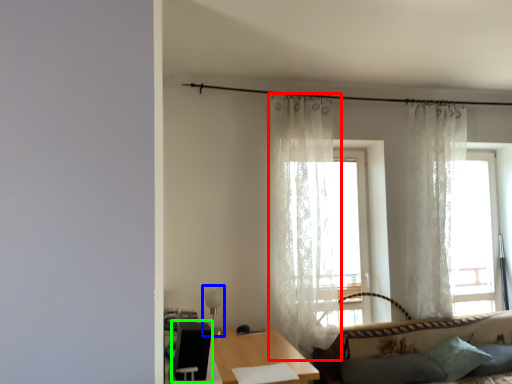
Question: Based on their relative distances, which object is nearer to curtain (highlighted by a red box)? Choose from lamp (highlighted by a blue box) and swivel chair (highlighted by a green box).

Choices:
 (A) lamp
 (B) swivel chair

Answer: (A)